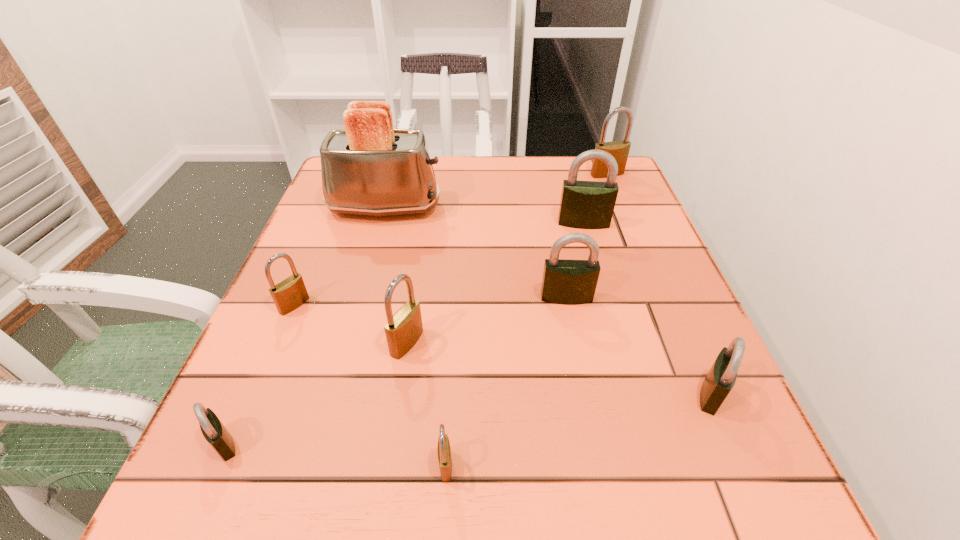
Identify the location of object that is positioned at the near left corner. This screenshot has height=540, width=960. (213, 430).

Locate an element on the screen. The image size is (960, 540). object situated at the far right corner is located at coordinates (619, 150).

Where is `vacant area at the far edge of the desktop`? This screenshot has height=540, width=960. vacant area at the far edge of the desktop is located at coordinates (439, 169).

I want to click on free space at the near edge, so click(311, 518).

I want to click on free spot at the left edge of the desktop, so click(304, 280).

Find the location of a particular element. The image size is (960, 540). free space at the right edge is located at coordinates (622, 288).

You are a GUI agent. You are given a task and a screenshot of the screen. Output one action in this format:
    pyautogui.click(x=<x>, y=<y>)
    Task: Click on the blank space at the near left corner of the desktop
    This screenshot has height=540, width=960.
    Given the screenshot: What is the action you would take?
    pyautogui.click(x=263, y=494)

Identify the location of free space at the far right corner of the desktop. The height and width of the screenshot is (540, 960). (625, 178).

Find the location of a particular element. This screenshot has width=960, height=540. vacant space at the near right corner is located at coordinates (787, 518).

In order to click on vacant area that lies between the third nearest black padlock and the rightmost black padlock in this screenshot , I will do `click(638, 346)`.